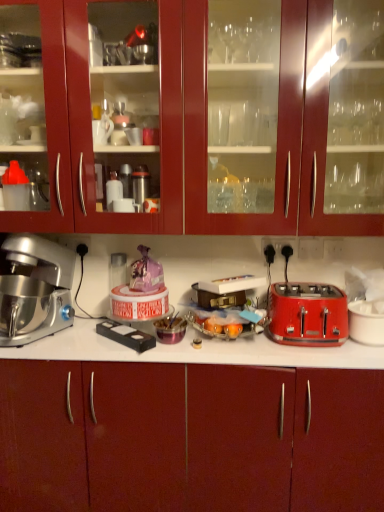
Identify the location of free space above matte wood cabinet at lower center, arranged as the first cabinetry when ordered from the bottom (from a real-world perspective). The height and width of the screenshot is (512, 384). (159, 349).